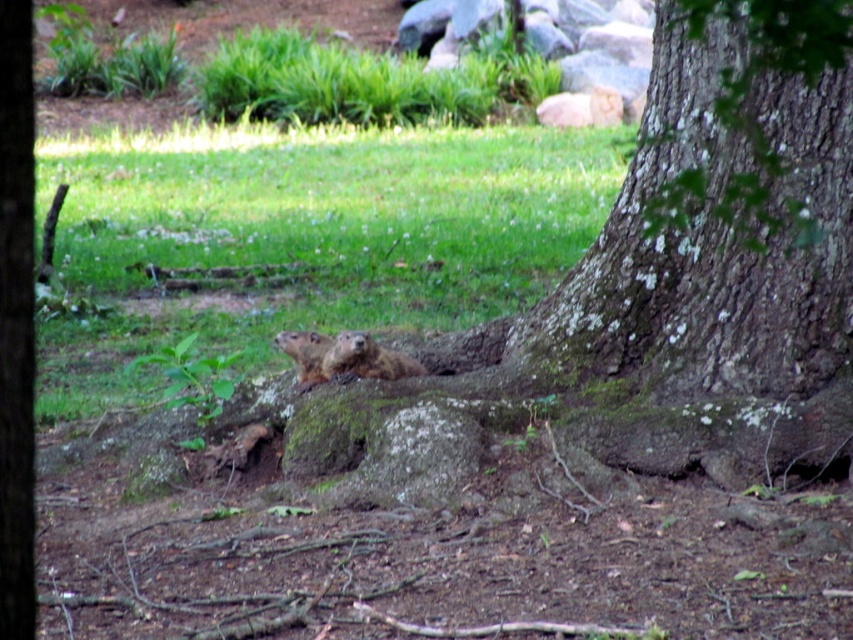
Consider the image. Between brown rough bark at center and brown furry ground squirrel at center, which one has more height?

brown rough bark at center is taller.

Is brown rough bark at center bigger than brown furry ground squirrel at center?

Incorrect, brown rough bark at center is not larger than brown furry ground squirrel at center.

Who is more forward, (x=0, y=157) or (x=328, y=349)?

Point (x=0, y=157) is in front.

Find the location of a particular element. brown rough bark at center is located at coordinates (16, 321).

Is point (370, 353) positioned before point (299, 332)?

Yes.

Is point (325, 353) less distant than point (320, 355)?

Yes, point (325, 353) is closer to viewer.

Locate an element on the screen. Image resolution: width=853 pixels, height=640 pixels. brown furry ground squirrel at center is located at coordinates (364, 358).

Is point (3, 253) positioned before point (281, 337)?

Yes, it is.

Who is positioned more to the right, brown rough bark at center or brown furry groundhog at center?

Positioned to the right is brown rough bark at center.

Which is in front, point (9, 435) or point (309, 353)?

Point (9, 435) is more forward.

Find the location of a particular element. Image resolution: width=853 pixels, height=640 pixels. brown rough bark at center is located at coordinates (16, 321).